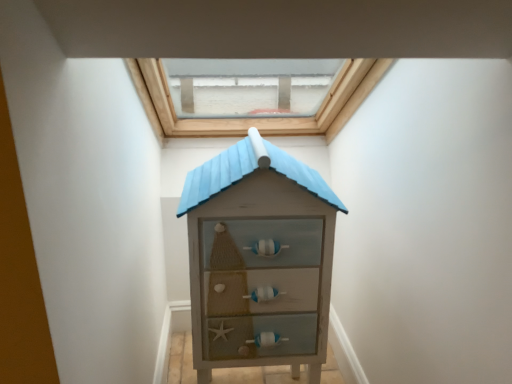
Question: Is transparent glass window at upper center taller or shorter than wooden house-shaped chest of drawers at center?

Choices:
 (A) short
 (B) tall

Answer: (A)

Question: In the image, is transparent glass window at upper center on the left side or the right side of wooden house-shaped chest of drawers at center?

Choices:
 (A) left
 (B) right

Answer: (A)

Question: Do you think transparent glass window at upper center is within wooden house-shaped chest of drawers at center, or outside of it?

Choices:
 (A) outside
 (B) inside

Answer: (A)

Question: Considering the positions of wooden house-shaped chest of drawers at center and transparent glass window at upper center in the image, is wooden house-shaped chest of drawers at center taller or shorter than transparent glass window at upper center?

Choices:
 (A) short
 (B) tall

Answer: (B)

Question: From the image's perspective, is wooden house-shaped chest of drawers at center located above or below transparent glass window at upper center?

Choices:
 (A) below
 (B) above

Answer: (A)

Question: Based on their sizes in the image, would you say wooden house-shaped chest of drawers at center is bigger or smaller than transparent glass window at upper center?

Choices:
 (A) small
 (B) big

Answer: (A)

Question: Is point (317, 264) closer or farther from the camera than point (180, 132)?

Choices:
 (A) closer
 (B) farther

Answer: (A)